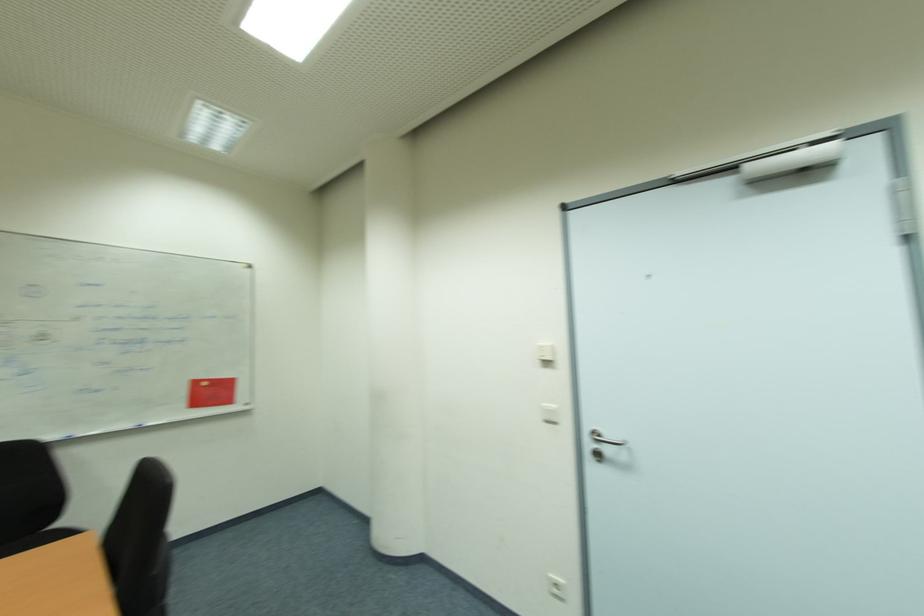
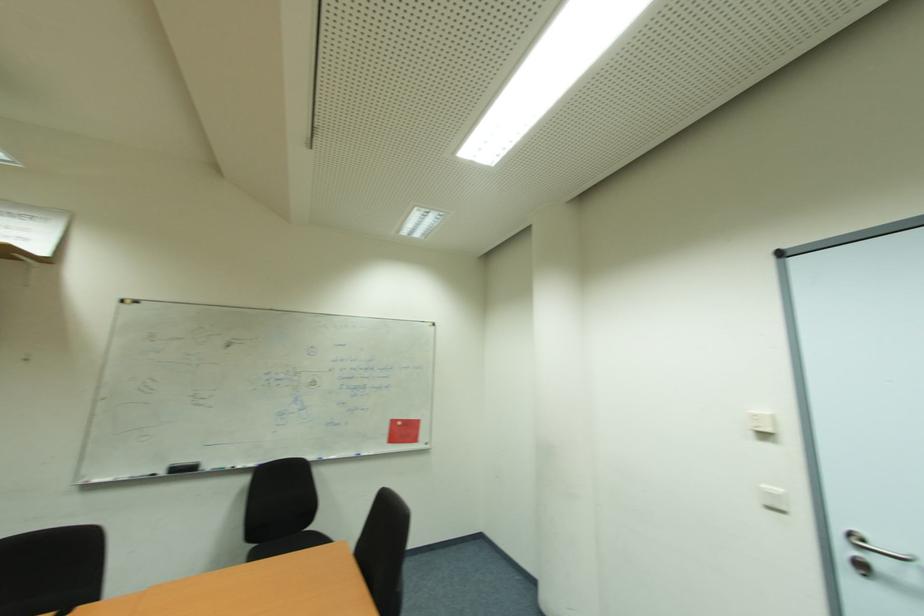
Where in the second image is the point corresponding to (197,383) from the first image?

(397, 423)